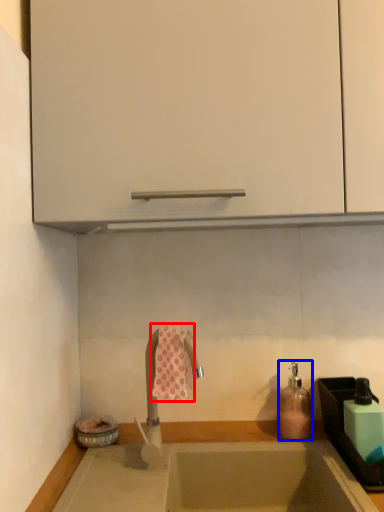
Question: Among these objects, which one is nearest to the camera, beach towel (highlighted by a red box) or soap dispenser (highlighted by a blue box)?

Choices:
 (A) beach towel
 (B) soap dispenser

Answer: (A)